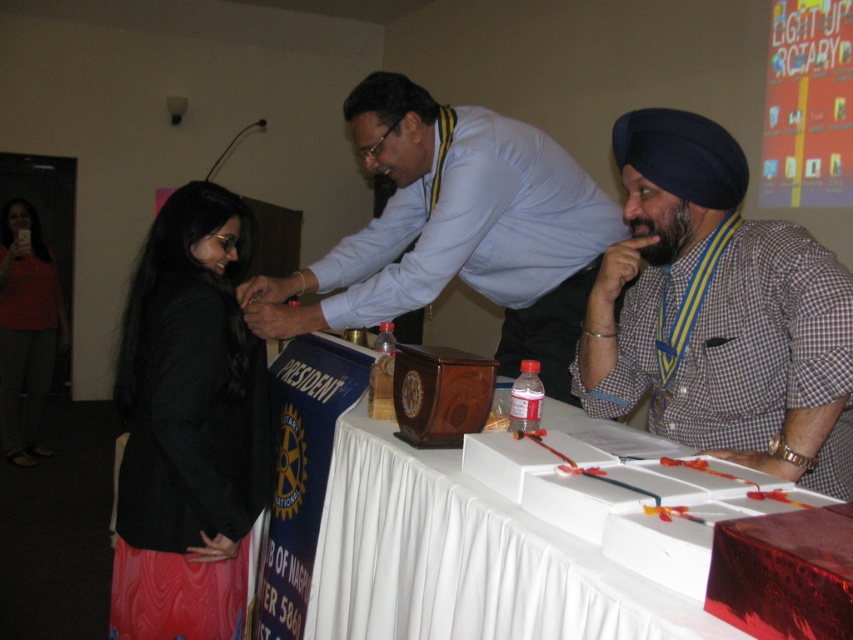
Question: Which of these objects is positioned farthest from the white wood table at center?

Choices:
 (A) black shiny hair at upper left
 (B) matte wood box at center

Answer: (A)

Question: Can you confirm if checkered fabric shirt at center is positioned above matte black jacket at left?

Choices:
 (A) no
 (B) yes

Answer: (B)

Question: Which object is positioned farthest from the black silky hair at left?

Choices:
 (A) black shiny hair at upper left
 (B) white wood table at center
 (C) matte wood box at center
 (D) black fabric jacket at left

Answer: (A)

Question: In this image, where is checkered fabric shirt at center located relative to black shiny hair at upper left?

Choices:
 (A) above
 (B) below

Answer: (B)

Question: Estimate the real-world distances between objects in this image. Which object is farther from the black silky hair at left?

Choices:
 (A) matte wood box at center
 (B) checkered fabric shirt at center
 (C) black shiny hair at upper left
 (D) black fabric jacket at left

Answer: (C)

Question: Is checkered fabric shirt at center bigger than matte wood box at center?

Choices:
 (A) no
 (B) yes

Answer: (A)